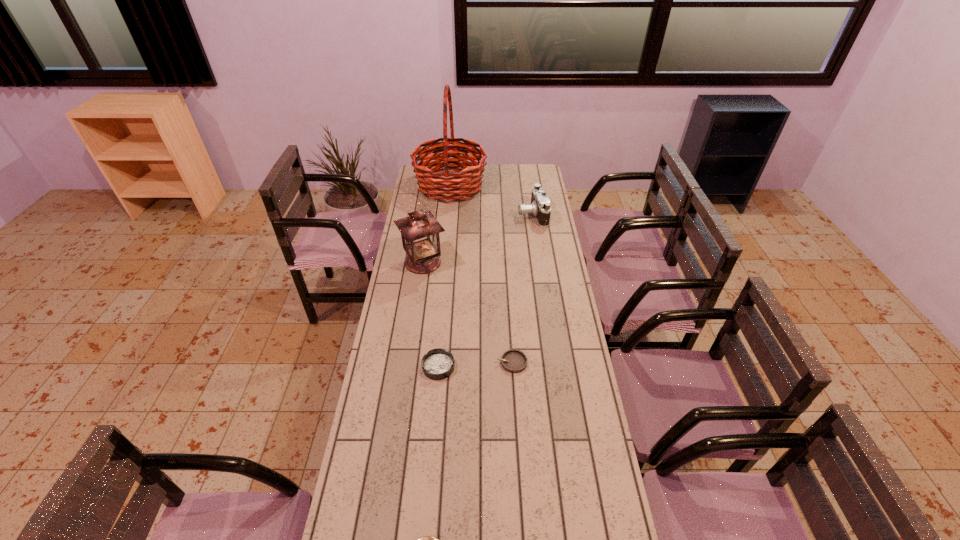
Locate an element on the screen. basket is located at coordinates (439, 184).

At what (x,y) coordinates should I click in order to perform the action: click on the third farthest object. Please return your answer as a coordinate pair (x, y). Looking at the image, I should click on (420, 230).

Image resolution: width=960 pixels, height=540 pixels. In order to click on the second tallest object in this screenshot , I will do `click(420, 230)`.

Identify the location of the third tallest object. The image size is (960, 540). (540, 204).

Locate an element on the screen. The height and width of the screenshot is (540, 960). camera is located at coordinates (540, 204).

This screenshot has width=960, height=540. I want to click on the second object from right to left, so click(x=514, y=361).

Identify the location of vacant space located 0.070m on the handle side of the basket. This screenshot has height=540, width=960. (500, 186).

Where is `free space located on the front of the fifth shortest object`? The height and width of the screenshot is (540, 960). free space located on the front of the fifth shortest object is located at coordinates (418, 301).

Locate an element on the screen. free region located 0.260m at the lens of the fourth shortest object is located at coordinates (468, 214).

Locate an element on the screen. This screenshot has width=960, height=540. vacant space located 0.140m at the lens of the fourth shortest object is located at coordinates (491, 214).